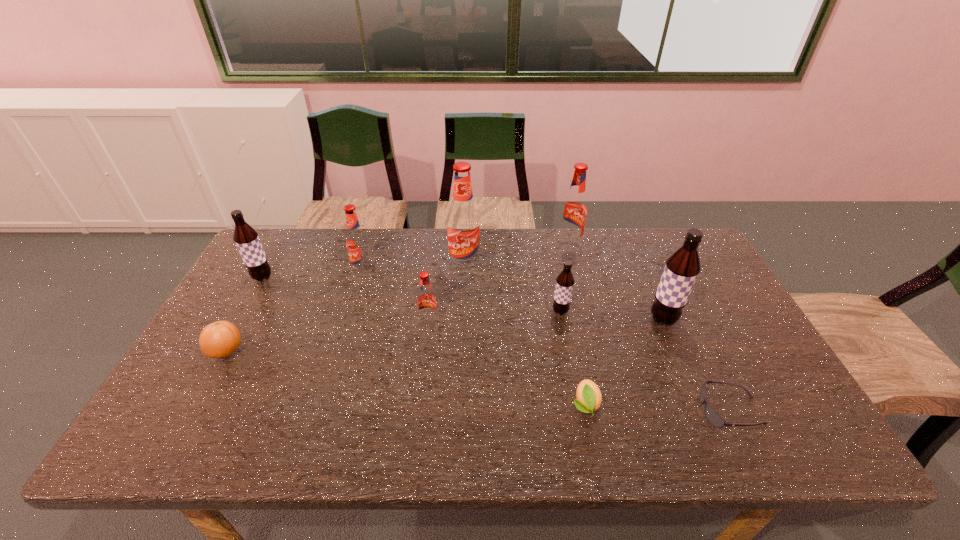
What are the coordinates of `the smallest red root beer` in the screenshot? It's located at (427, 305).

I want to click on the third red root beer from right to left, so click(427, 305).

Where is `the third root beer from right to left`? the third root beer from right to left is located at coordinates (565, 281).

Locate an element on the screen. This screenshot has width=960, height=540. the second brown root beer from right to left is located at coordinates (565, 281).

Find the location of a particular element. the third shortest object is located at coordinates (220, 339).

Find the location of a particular element. The width and height of the screenshot is (960, 540). orange is located at coordinates (220, 339).

Locate an element on the screen. This screenshot has height=540, width=960. the second shortest object is located at coordinates (589, 398).

Where is `yellow lemon`? The image size is (960, 540). yellow lemon is located at coordinates (589, 398).

Identify the location of the shortest object. (712, 416).

This screenshot has width=960, height=540. In order to click on vacant space located on the front of the second red root beer from right to left in this screenshot , I will do `click(463, 327)`.